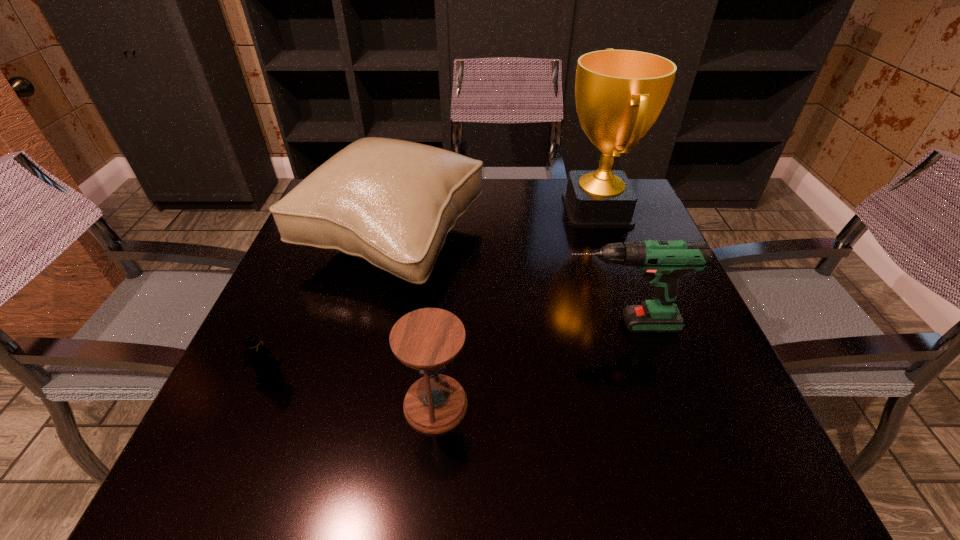
Find the location of `the tallest object`. the tallest object is located at coordinates (619, 94).

This screenshot has height=540, width=960. Identify the location of cushion. (391, 202).

Where is `drill`? drill is located at coordinates (662, 262).

The width and height of the screenshot is (960, 540). Find the location of `the fourth tallest object`. the fourth tallest object is located at coordinates (427, 340).

At what (x,y) coordinates should I click in order to perform the action: click on Lego. Please return your answer as a coordinate pair (x, y). The height and width of the screenshot is (540, 960). Looking at the image, I should click on (265, 363).

Where is `vacant space situated on the front-facing side of the tallest object`? Image resolution: width=960 pixels, height=540 pixels. vacant space situated on the front-facing side of the tallest object is located at coordinates (489, 210).

The image size is (960, 540). In order to click on vacant area located on the front-facing side of the tallest object in this screenshot , I will do (522, 210).

Where is `free space located on the front-facing side of the tallest object`? Image resolution: width=960 pixels, height=540 pixels. free space located on the front-facing side of the tallest object is located at coordinates (511, 210).

Locate an element on the screen. Image resolution: width=960 pixels, height=540 pixels. free space located on the right of the cushion is located at coordinates (527, 240).

You are a GUI agent. You are given a task and a screenshot of the screen. Output one action in this format:
    pyautogui.click(x=<x>, y=<y>)
    Task: Click on the vacant area situated on the handle side of the third farthest object
    The height and width of the screenshot is (540, 960).
    Given the screenshot: What is the action you would take?
    pyautogui.click(x=436, y=325)